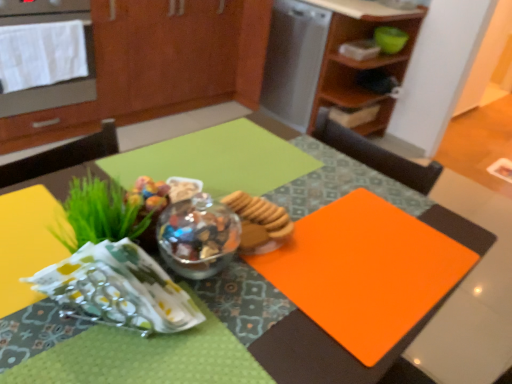
Where is `free spot above orange matte placemat at center (from a real-world perspective)`? This screenshot has width=512, height=384. free spot above orange matte placemat at center (from a real-world perspective) is located at coordinates (263, 239).